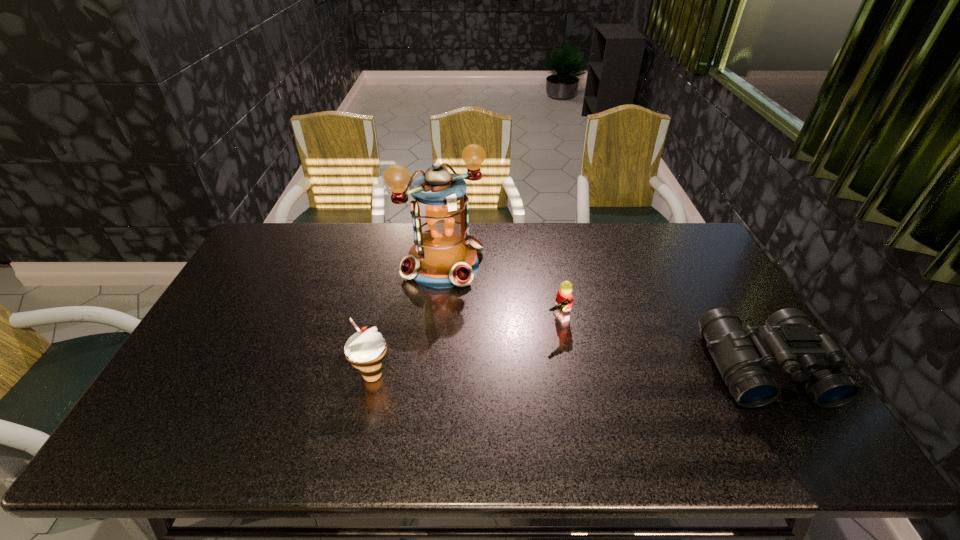
In the image, there is a desktop. Find the location of `free space at the left edge`. free space at the left edge is located at coordinates point(258,294).

Identify the location of vacant position at the right edge of the desktop. (707, 279).

This screenshot has height=540, width=960. Find the location of `vacant space at the far left corner`. vacant space at the far left corner is located at coordinates (269, 251).

At what (x,y) coordinates should I click in order to perform the action: click on vacant space at the near left corner of the desktop. Please return your answer as a coordinate pair (x, y). The height and width of the screenshot is (540, 960). Looking at the image, I should click on (200, 414).

You are a GUI agent. You are given a task and a screenshot of the screen. Output one action in this format:
    pyautogui.click(x=<x>, y=<y>)
    Task: Click on the empty space that is in between the second object from right to left and the icecream
    This screenshot has height=540, width=960.
    Given the screenshot: What is the action you would take?
    pyautogui.click(x=465, y=347)

Where is `free space between the lantern and the second object from right to left`? The height and width of the screenshot is (540, 960). free space between the lantern and the second object from right to left is located at coordinates (500, 292).

The image size is (960, 540). Identify the location of empty space between the rightmost object and the lantern. [x=604, y=316].

This screenshot has height=540, width=960. I want to click on free space between the tallest object and the shortest object, so click(500, 292).

The width and height of the screenshot is (960, 540). Find the location of `empty location between the shortest object and the binoculars`. empty location between the shortest object and the binoculars is located at coordinates (660, 343).

The image size is (960, 540). Find the location of `free space between the shortest object and the rightmost object`. free space between the shortest object and the rightmost object is located at coordinates pyautogui.click(x=660, y=343).